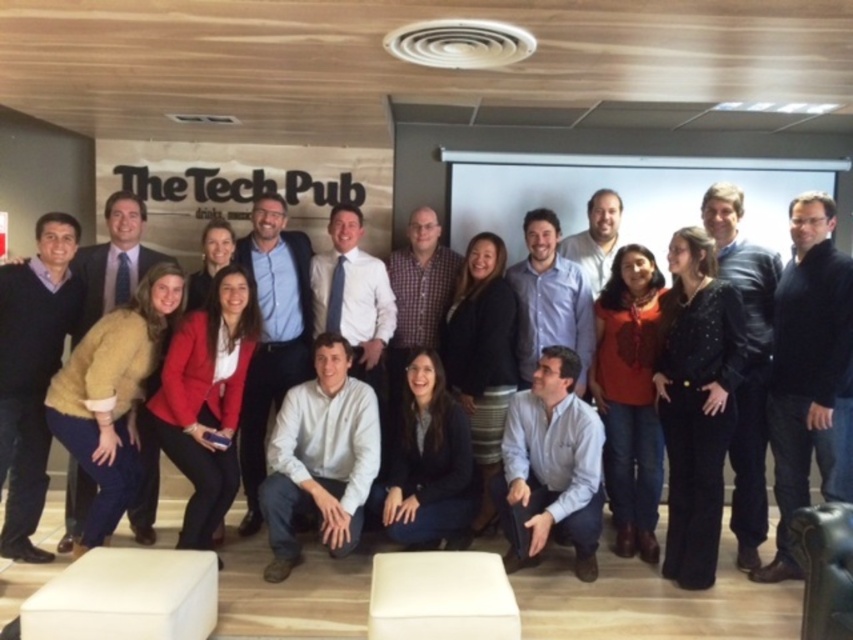
You are organizing a photo shoot and need to ensure that the black sweater at center and the black matte jacket at center are positioned correctly. According to the scene description, which object is located to the right of the other?

The black sweater at center is to the right of the black matte jacket at center.

You are organizing a photo shoot and need to arrange two black sweaters for a display. The black sweater at center and the matte black sweater at left are available. Which sweater should you choose if you want the taller one for the display?

The black sweater at center is much taller than the matte black sweater at left, so you should choose the black sweater at center for the display.